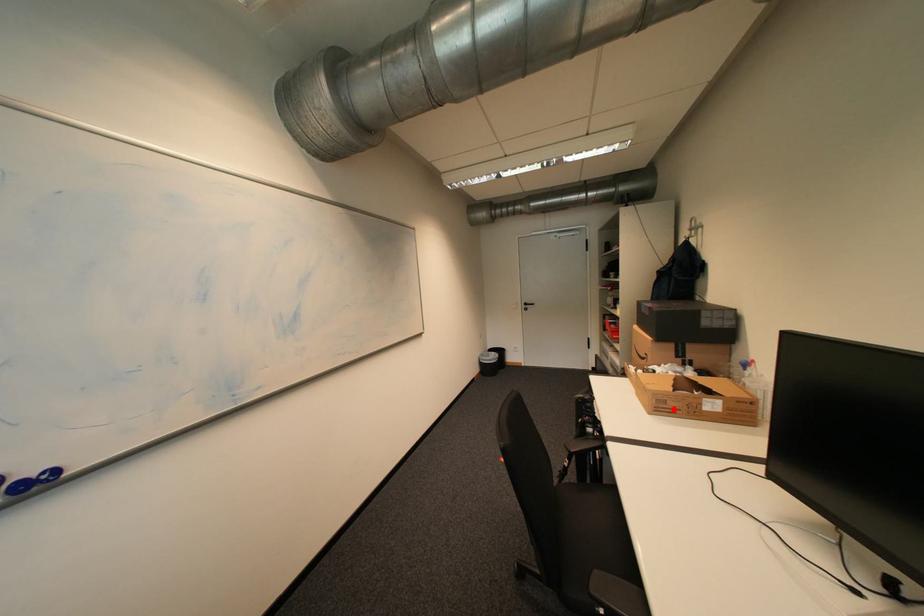
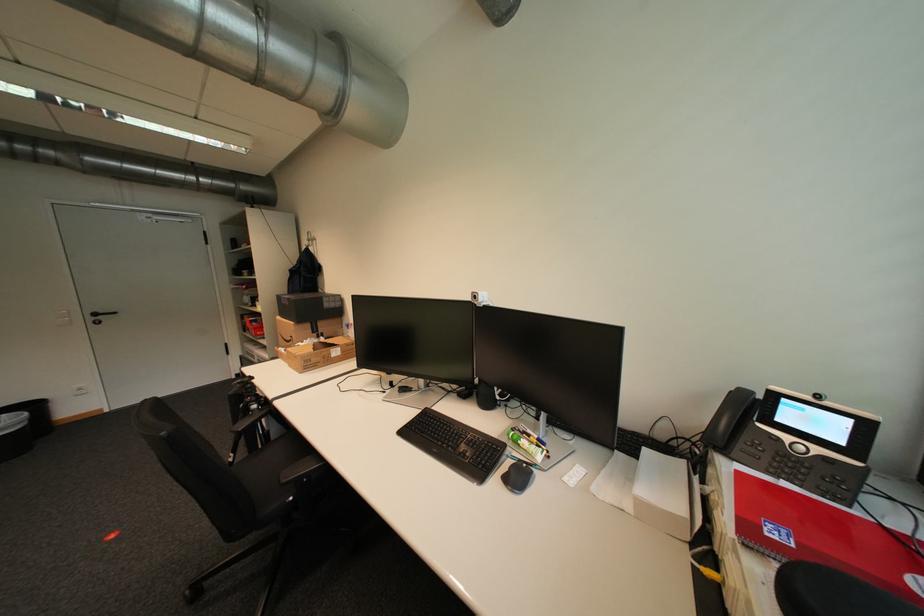
Find the pixel in the second image that matches the highlighted location in the first image.

(319, 365)